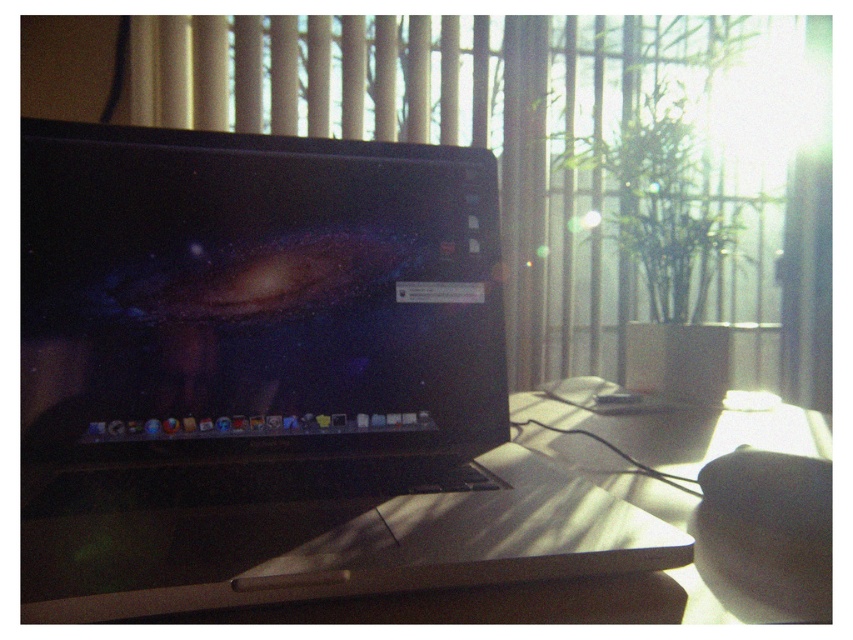
Question: Among these objects, which one is farthest from the camera?

Choices:
 (A) satin black laptop at center
 (B) transparent glass window at center

Answer: (B)

Question: From the image, what is the correct spatial relationship of satin black laptop at center in relation to transparent glass window at center?

Choices:
 (A) below
 (B) above

Answer: (A)

Question: Which point is closer to the camera taking this photo?

Choices:
 (A) (675, 547)
 (B) (256, 380)
 (C) (598, 61)

Answer: (A)

Question: Can you confirm if satin black laptop at center is positioned to the right of transparent glass window at center?

Choices:
 (A) no
 (B) yes

Answer: (A)

Question: Can you confirm if transparent glass window at center is positioned to the right of smooth wooden table at center?

Choices:
 (A) yes
 (B) no

Answer: (A)

Question: Which is nearer to the smooth wooden table at center?

Choices:
 (A) satin black laptop at center
 (B) transparent glass window at center

Answer: (A)